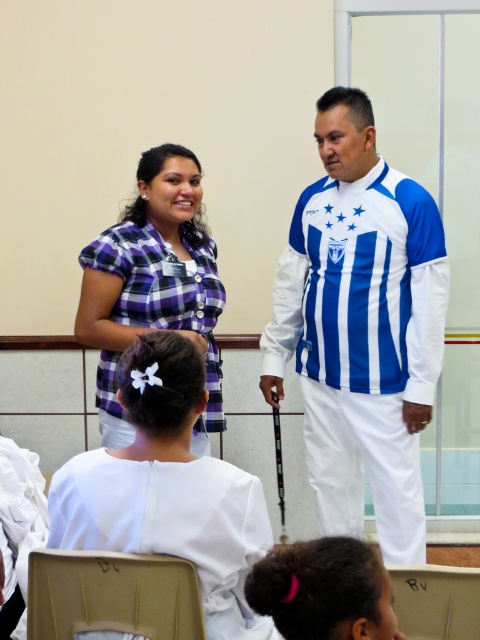
Question: Is blue and white striped jersey at center to the left of white plastic chair at lower center from the viewer's perspective?

Choices:
 (A) yes
 (B) no

Answer: (A)

Question: Among these points, which one is nearest to the camera?

Choices:
 (A) (402, 621)
 (B) (26, 625)
 (C) (424, 280)

Answer: (A)

Question: Can you confirm if purple checkered shirt at center is wider than beige fabric chair at lower left?

Choices:
 (A) yes
 (B) no

Answer: (A)

Question: Which is nearer to the blue and white striped jersey at center?

Choices:
 (A) beige fabric chair at lower left
 (B) purple checkered shirt at center

Answer: (B)

Question: Which of the following is the closest to the observer?

Choices:
 (A) (255, 500)
 (B) (307, 566)
 (C) (116, 285)

Answer: (B)

Question: Is blue and white striped jersey at center positioned at the back of white plastic chair at lower center?

Choices:
 (A) yes
 (B) no

Answer: (A)